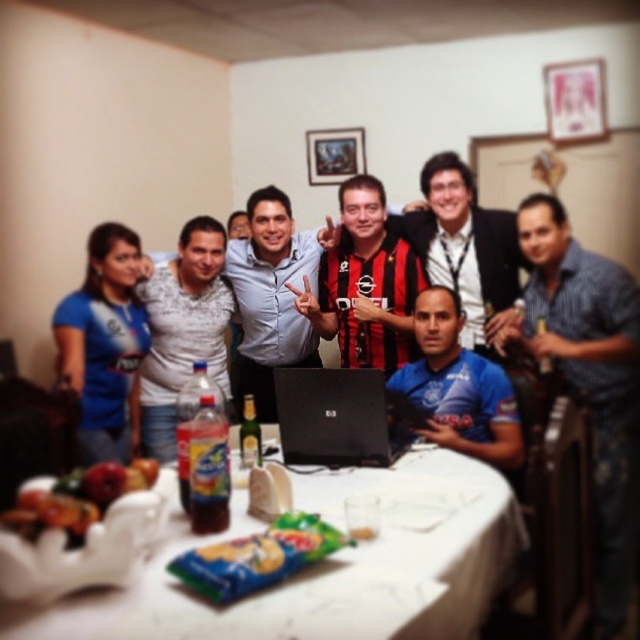
Does white plastic table at center have a lesser width compared to matte blue shirt at center?

Incorrect, white plastic table at center's width is not less than matte blue shirt at center's.

Is white plastic table at center wider than matte blue shirt at center?

Yes.

Does point (321, 502) lie in front of point (285, 280)?

Yes, it is in front of point (285, 280).

I want to click on white plastic table at center, so click(x=326, y=566).

Consider the image. Is white matte shirt at center positioned behind blue jersey at center?

Yes, white matte shirt at center is further from the viewer.

Between white matte shirt at center and blue jersey at center, which one appears on the left side from the viewer's perspective?

white matte shirt at center is more to the left.

Which is in front, point (170, 368) or point (433, 369)?

Point (433, 369) is more forward.

Find the location of a particular element. This screenshot has width=640, height=640. white matte shirt at center is located at coordinates (182, 328).

In the scene shown: Between white plastic table at center and wooden picture frame at upper center, which one has less height?

white plastic table at center is shorter.

Who is taller, white plastic table at center or wooden picture frame at upper center?

Standing taller between the two is wooden picture frame at upper center.

What do you see at coordinates (326, 566) in the screenshot? I see `white plastic table at center` at bounding box center [326, 566].

The width and height of the screenshot is (640, 640). I want to click on white plastic table at center, so [326, 566].